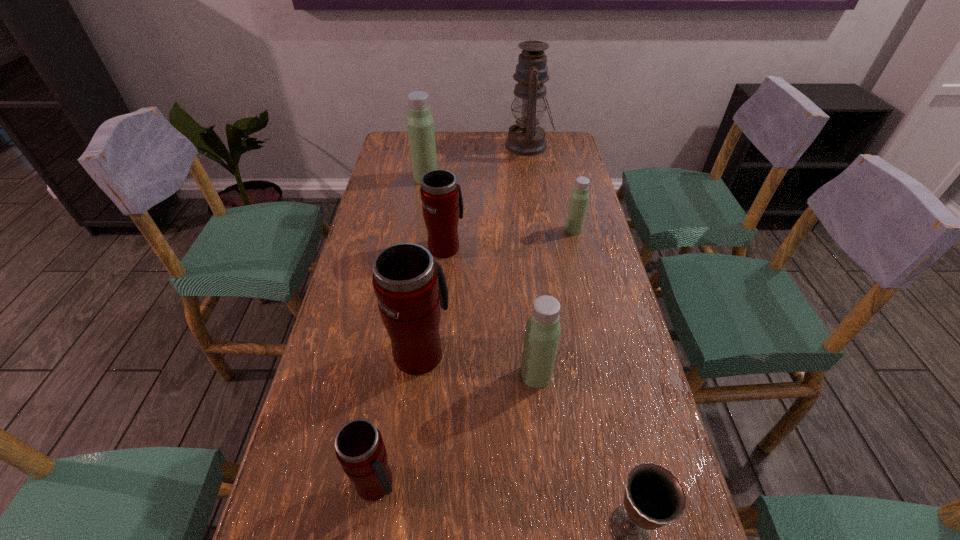
You are a GUI agent. You are given a task and a screenshot of the screen. Output one action in this format:
    pyautogui.click(x=<x>, y=<y>)
    Task: Click on the brown oil lamp
    This screenshot has width=960, height=540.
    Given the screenshot: What is the action you would take?
    pyautogui.click(x=526, y=138)

Locate an element on the screen. oil lamp is located at coordinates (526, 138).

The height and width of the screenshot is (540, 960). I want to click on the leftmost light thermos bottle, so click(x=421, y=131).

Where is `the seventh nearest object`? The width and height of the screenshot is (960, 540). the seventh nearest object is located at coordinates (421, 131).

This screenshot has height=540, width=960. I want to click on the second nearest red thermos bottle, so coord(410,286).

Locate an element on the screen. The image size is (960, 540). the second smallest red thermos bottle is located at coordinates (442, 203).

At what (x,y) coordinates should I click in order to perform the action: click on the nearest light thermos bottle. Please return your answer as a coordinate pair (x, y). Looking at the image, I should click on (542, 333).

Where is `the second smallest light thermos bottle`? This screenshot has width=960, height=540. the second smallest light thermos bottle is located at coordinates (542, 333).

Where is `the nearest red thermos bottle`? the nearest red thermos bottle is located at coordinates (359, 447).

What are the coordinates of `the smallest red thermos bottle` in the screenshot? It's located at tap(359, 447).